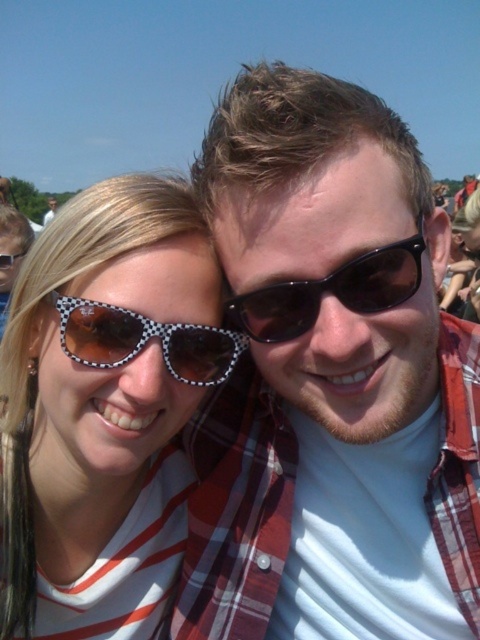
Question: Is polka dot sunglasses at left below checkered plastic sunglasses at upper left?

Choices:
 (A) yes
 (B) no

Answer: (A)

Question: From the image, what is the correct spatial relationship of black textured sunglasses at center in relation to checkered plastic sunglasses at upper left?

Choices:
 (A) left
 (B) right

Answer: (B)

Question: Is polka dot sunglasses at left positioned before black textured sunglasses at center?

Choices:
 (A) no
 (B) yes

Answer: (A)

Question: Which point appears farthest from the camera in this image?

Choices:
 (A) (288, 305)
 (B) (19, 257)
 (C) (186, 369)
 (D) (163, 403)

Answer: (B)

Question: Which point is farther from the camera taking this photo?

Choices:
 (A) (12, 266)
 (B) (48, 289)
 (C) (420, 228)

Answer: (A)

Question: Which point is farther from the camera taking this photo?

Choices:
 (A) (314, 284)
 (B) (171, 355)

Answer: (B)